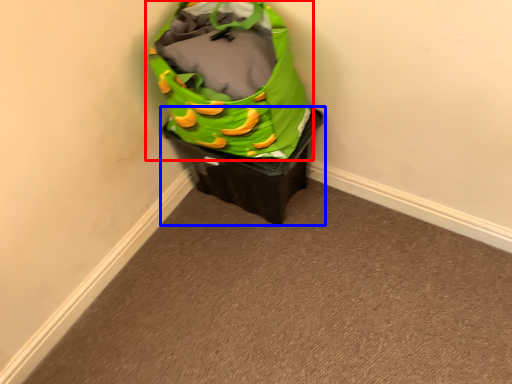
Question: Among these objects, which one is farthest to the camera, luggage and bags (highlighted by a red box) or waste container (highlighted by a blue box)?

Choices:
 (A) luggage and bags
 (B) waste container

Answer: (B)